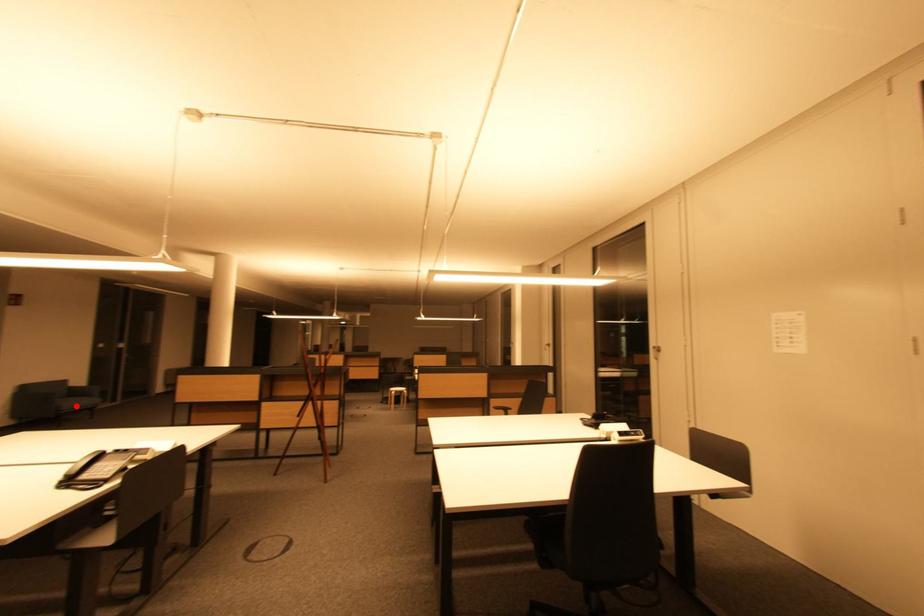
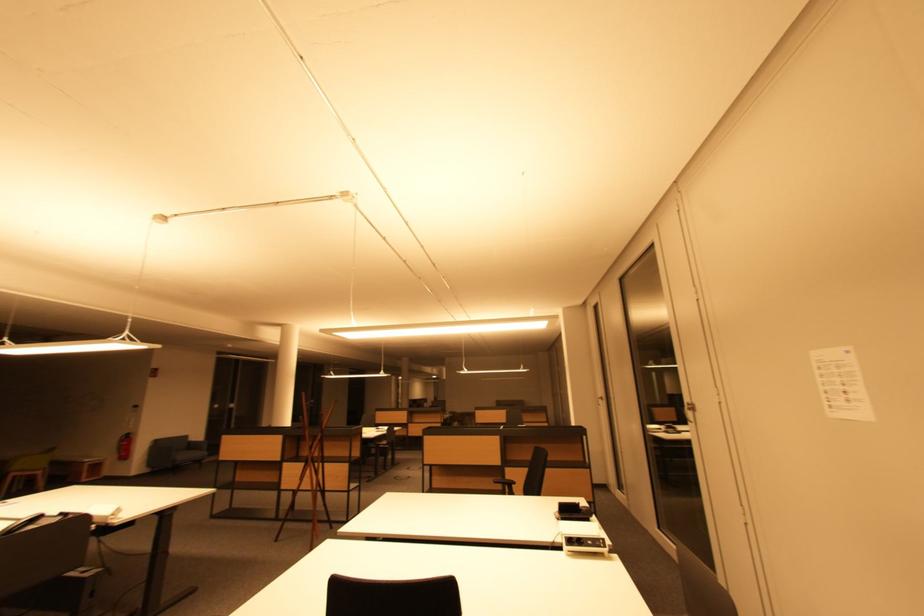
Question: I am providing you with two images of the same scene from different viewpoints. A red point is shown in image1. For the corresponding object point in image2, is it positioned nearer or farther from the camera?

Choices:
 (A) Nearer
 (B) Farther

Answer: (B)